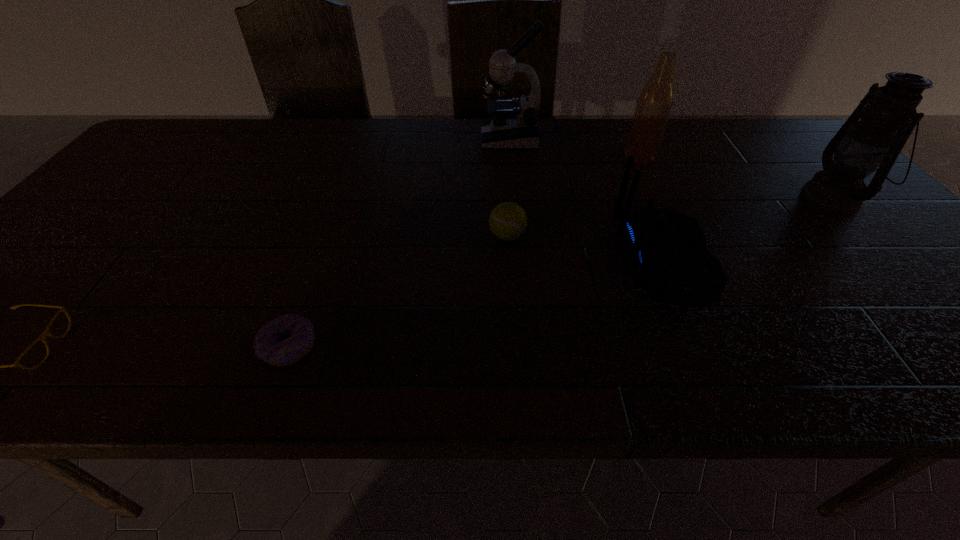
The width and height of the screenshot is (960, 540). Find the location of `free region at the right edge of the desktop`. free region at the right edge of the desktop is located at coordinates (910, 264).

Where is `vacant region at the far left corner of the desktop`? vacant region at the far left corner of the desktop is located at coordinates (177, 154).

I want to click on free space between the tennis ball and the doughnut, so click(398, 292).

The height and width of the screenshot is (540, 960). In order to click on free space between the oil lamp and the fourth tallest object in this screenshot , I will do `click(749, 229)`.

What are the coordinates of `vacant point located between the beer bottle and the sixth object from right to left` in the screenshot? It's located at (465, 252).

I want to click on empty space that is in between the second object from left to right and the router, so click(x=476, y=303).

Locate an element on the screen. object that ranks as the fifth closest to the rightmost object is located at coordinates (271, 345).

The height and width of the screenshot is (540, 960). In order to click on object that is the second closest to the second object from left to right in this screenshot , I will do `click(507, 221)`.

You are a GUI agent. You are given a task and a screenshot of the screen. Output one action in this format:
    pyautogui.click(x=<x>, y=<y>)
    Task: Click on the vacant space that satisfies the following two spatial constraints: 1. on the front side of the beer bottle; 2. on the right side of the microscope
    The width and height of the screenshot is (960, 540).
    Given the screenshot: What is the action you would take?
    pyautogui.click(x=512, y=157)